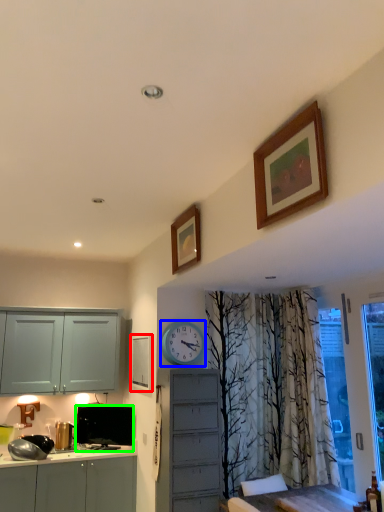
Question: Estimate the real-world distances between objects in this image. Which object is farther from picture frame (highlighted by a red box), clock (highlighted by a blue box) or television (highlighted by a green box)?

Choices:
 (A) clock
 (B) television

Answer: (B)